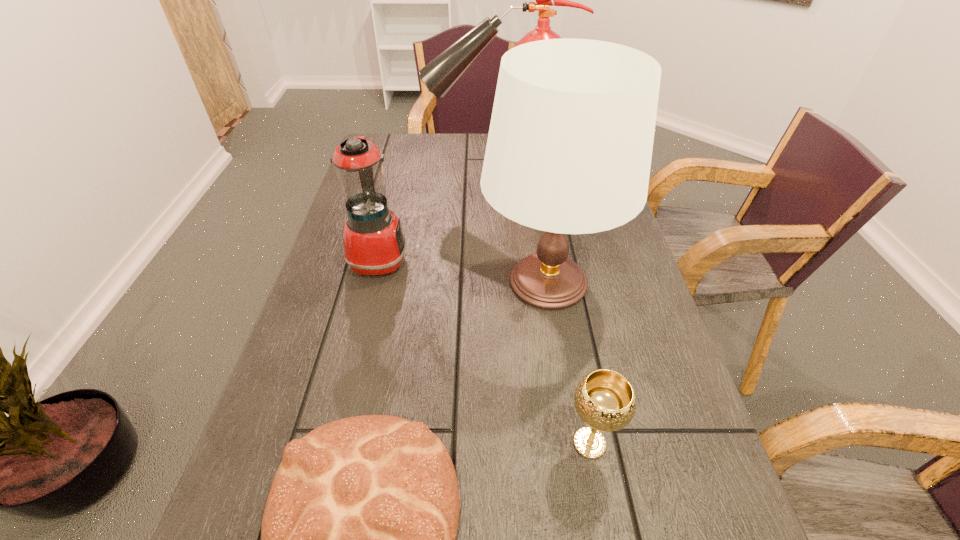
The height and width of the screenshot is (540, 960). What are the coordinates of `fire extinguisher` in the screenshot? It's located at (439, 75).

This screenshot has width=960, height=540. Find the location of `lamp`. lamp is located at coordinates (569, 149).

The image size is (960, 540). What are the coordinates of `the third tallest object` in the screenshot? It's located at (374, 244).

The height and width of the screenshot is (540, 960). I want to click on chalice, so click(x=605, y=400).

The height and width of the screenshot is (540, 960). What are the coordinates of `vacant space located at the nozzle end of the farthest object` in the screenshot? It's located at (412, 179).

Locate an element on the screen. This screenshot has width=960, height=540. vacant space located 0.190m at the nozzle end of the farthest object is located at coordinates (366, 179).

Locate an element on the screen. The height and width of the screenshot is (540, 960). free space located at the nozzle end of the farthest object is located at coordinates (392, 179).

Identify the location of vacant region located on the back of the lamp. tap(535, 199).

The width and height of the screenshot is (960, 540). I want to click on vacant area situated on the controls of the third tallest object, so click(477, 259).

This screenshot has height=540, width=960. Find the location of `vacant space located 0.290m on the back of the chalice`. vacant space located 0.290m on the back of the chalice is located at coordinates (563, 299).